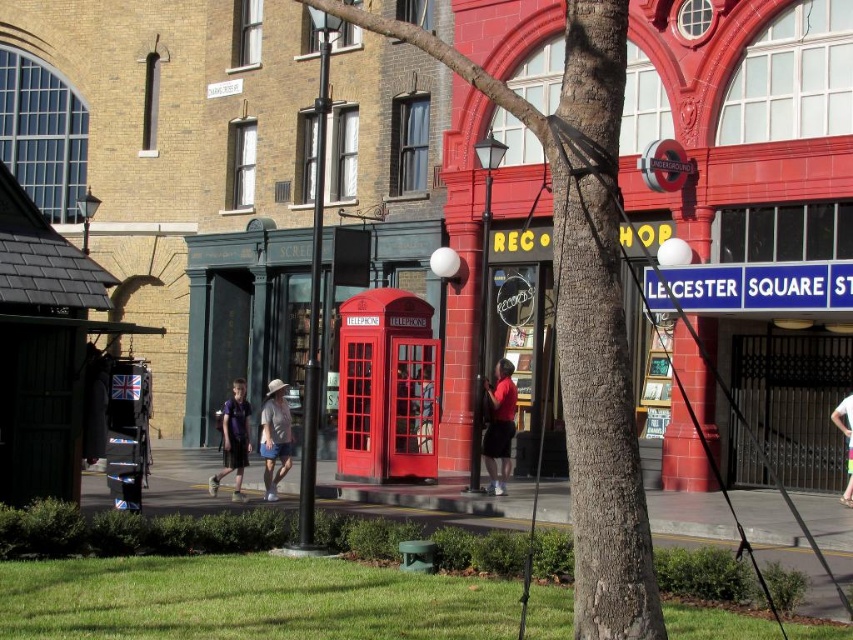
Which of these two, glossy red telephone box at center or white fabric pants at lower right, stands taller?

With more height is glossy red telephone box at center.

Which is in front, point (412, 312) or point (846, 406)?

Point (846, 406)

Where is `glossy red telephone box at center`? Image resolution: width=853 pixels, height=640 pixels. glossy red telephone box at center is located at coordinates (386, 388).

Who is taller, denim shorts at center or dark blue jersey at center?

With more height is dark blue jersey at center.

Is denim shorts at center to the right of dark blue jersey at center from the viewer's perspective?

Indeed, denim shorts at center is positioned on the right side of dark blue jersey at center.

Between point (283, 392) and point (225, 426), which one is positioned in front?

Positioned in front is point (225, 426).

Find the location of a particular element. denim shorts at center is located at coordinates (274, 436).

Can you confirm if red matte shirt at center is positioned above denim shorts at center?

Yes.

Does red matte shirt at center have a larger size compared to denim shorts at center?

Yes, red matte shirt at center is bigger than denim shorts at center.

Which is behind, point (489, 422) or point (264, 436)?

The point (489, 422) is more distant.

Image resolution: width=853 pixels, height=640 pixels. In order to click on red matte shirt at center in this screenshot , I will do `click(498, 426)`.